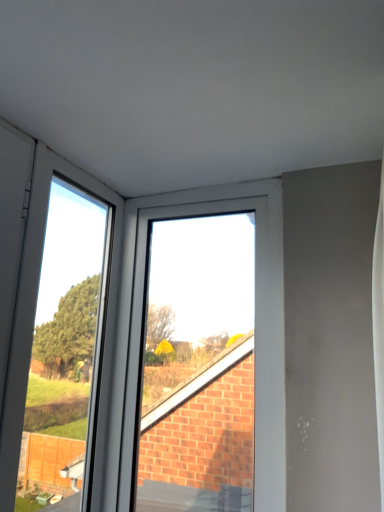
Where is `white plastic window at upper center`? white plastic window at upper center is located at coordinates (197, 354).

The image size is (384, 512). What do you see at coordinates (197, 354) in the screenshot? I see `white plastic window at upper center` at bounding box center [197, 354].

Identify the location of transparent glass door at left. (51, 319).

What do you see at coordinates (51, 319) in the screenshot? The height and width of the screenshot is (512, 384). I see `transparent glass door at left` at bounding box center [51, 319].

The width and height of the screenshot is (384, 512). In order to click on white plastic window at upper center in this screenshot , I will do `click(197, 354)`.

Considering the positions of objects transparent glass door at left and white plastic window at upper center in the image provided, who is more to the right, transparent glass door at left or white plastic window at upper center?

Positioned to the right is white plastic window at upper center.

Is transparent glass door at left in front of white plastic window at upper center?

Yes, transparent glass door at left is in front of white plastic window at upper center.

Which point is more forward, (x=7, y=184) or (x=136, y=359)?

The point (x=7, y=184) is closer to the camera.

From the image's perspective, is transparent glass door at left under white plastic window at upper center?

No, from the image's perspective, transparent glass door at left is not beneath white plastic window at upper center.

From a real-world perspective, is transparent glass door at left over white plastic window at upper center?

No, from a real-world perspective, transparent glass door at left is not over white plastic window at upper center

Looking at their sizes, would you say transparent glass door at left is wider or thinner than white plastic window at upper center?

In the image, transparent glass door at left appears to be more narrow than white plastic window at upper center.

Who is taller, transparent glass door at left or white plastic window at upper center?

white plastic window at upper center is taller.

Does transparent glass door at left have a larger size compared to white plastic window at upper center?

Incorrect, transparent glass door at left is not larger than white plastic window at upper center.

Is transparent glass door at left positioned beyond the bounds of white plastic window at upper center?

Yes.

Would you consider transparent glass door at left to be distant from white plastic window at upper center?

No, transparent glass door at left is not far from white plastic window at upper center.

Could you tell me if transparent glass door at left is facing white plastic window at upper center?

Yes, transparent glass door at left is aimed at white plastic window at upper center.

Measure the distance from transparent glass door at left to white plastic window at upper center.

A distance of 12.13 inches exists between transparent glass door at left and white plastic window at upper center.

Image resolution: width=384 pixels, height=512 pixels. Identify the location of glass door in front of the white plastic window at upper center. click(51, 319).

Is white plastic window at upper center at the right side of transparent glass door at left?

Correct, you'll find white plastic window at upper center to the right of transparent glass door at left.

Is the depth of white plastic window at upper center less than that of transparent glass door at left?

No.

Is point (207, 283) less distant than point (66, 179)?

No, it is behind (66, 179).

From the image's perspective, which object appears higher, white plastic window at upper center or transparent glass door at left?

From the image's view, transparent glass door at left is above.

From a real-world perspective, which is physically below, white plastic window at upper center or transparent glass door at left?

transparent glass door at left is physically lower.

Is white plastic window at upper center wider than transparent glass door at left?

Correct, the width of white plastic window at upper center exceeds that of transparent glass door at left.

Does white plastic window at upper center have a greater height compared to transparent glass door at left?

Correct, white plastic window at upper center is much taller as transparent glass door at left.

Which of these two, white plastic window at upper center or transparent glass door at left, is bigger?

white plastic window at upper center is bigger.

Is white plastic window at upper center positioned beyond the bounds of transparent glass door at left?

Yes.

Would you say white plastic window at upper center is a long distance from transparent glass door at left?

No, white plastic window at upper center is not far away from transparent glass door at left.

Is white plastic window at upper center oriented away from transparent glass door at left?

No, white plastic window at upper center is not facing the opposite direction of transparent glass door at left.

How far apart are white plastic window at upper center and transparent glass door at left?

white plastic window at upper center is 30.80 centimeters away from transparent glass door at left.

Where is `bay window above the transparent glass door at left (from a real-world perspective)`? bay window above the transparent glass door at left (from a real-world perspective) is located at coordinates (197, 354).

Find the location of a particular element. glass door above the white plastic window at upper center (from the image's perspective) is located at coordinates (51, 319).

I want to click on glass door to the left of white plastic window at upper center, so click(51, 319).